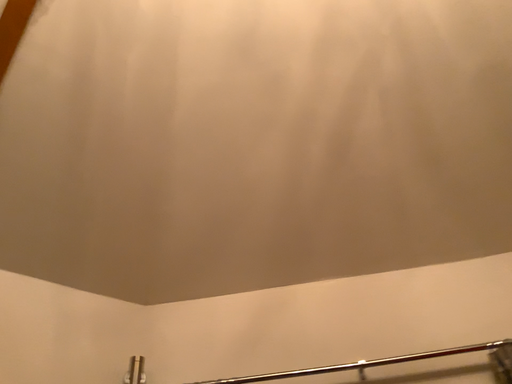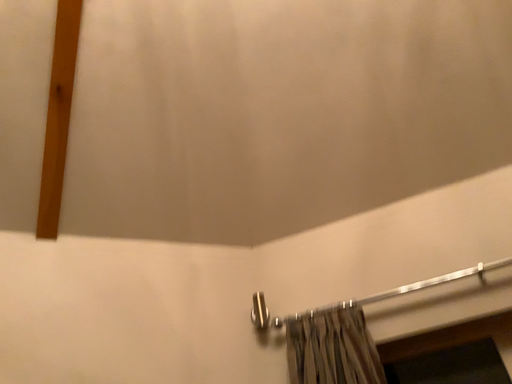
Question: Which way did the camera rotate in the video?

Choices:
 (A) rotated downward
 (B) rotated upward

Answer: (A)